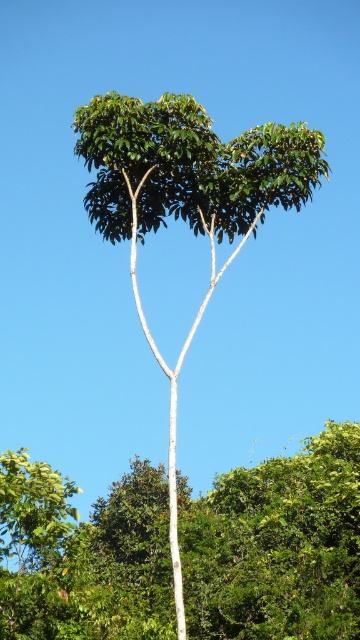
You are planning to plant a new tree in your garden. You have two options shown in the image. The first is the green leafy tree at center, and the second is the green matte tree at center. Which tree would require less space due to its size?

The green leafy tree at center is smaller than the green matte tree at center, so it would require less space.

You are standing in a tropical garden and want to take a photo of both the green leafy tree at center and the green matte tree at center. Which tree should you focus on first to ensure both are in the frame?

You should focus on the green leafy tree at center first because it is closer to you than the green matte tree at center, so adjusting the camera to include both would require ensuring the closer one is framed properly first.

You are standing at a point where you can see the tree in the image. A point labeled as point (159, 477) is marked in the scene. If you want to place a 25 meters long ladder to reach that point, will it be sufficient?

The distance of point (159, 477) from camera is 26.35 meters. The ladder is 25 meters long, so it will not be sufficient to reach the point as the distance is greater than the ladder length.